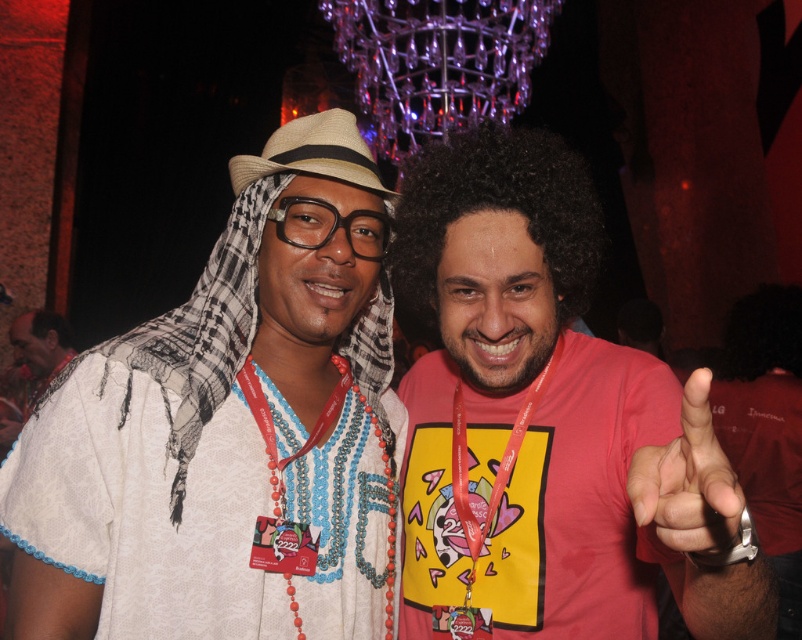
Question: Does pink matte shirt at center appear under beige straw cowboy hat at center?

Choices:
 (A) yes
 (B) no

Answer: (A)

Question: Which object appears closest to the camera in this image?

Choices:
 (A) pink matte finger at center
 (B) white woven cloth at left

Answer: (A)

Question: From the image, what is the correct spatial relationship of white woven cloth at left in relation to beige straw cowboy hat at center?

Choices:
 (A) above
 (B) below

Answer: (B)

Question: Based on their relative distances, which object is nearer to the beige straw cowboy hat at center?

Choices:
 (A) white woven cloth at left
 (B) pink matte finger at center
 (C) pink matte shirt at center

Answer: (A)

Question: Does white woven cloth at left have a larger size compared to beige straw cowboy hat at center?

Choices:
 (A) no
 (B) yes

Answer: (B)

Question: Which point appears farthest from the camera in this image?

Choices:
 (A) (707, 547)
 (B) (290, 252)

Answer: (B)